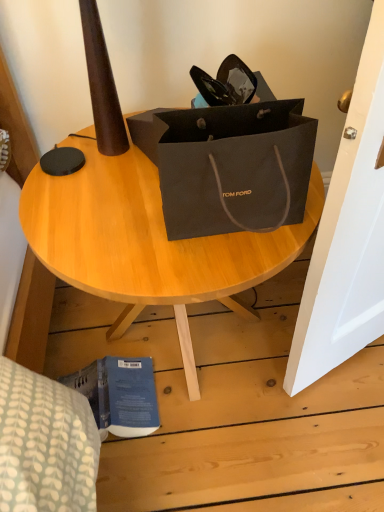
Question: From a real-world perspective, is blue matte book at lower left positioned above or below matte black bag at upper center?

Choices:
 (A) above
 (B) below

Answer: (B)

Question: Is blue matte book at lower left to the left or to the right of matte black bag at upper center in the image?

Choices:
 (A) left
 (B) right

Answer: (A)

Question: In terms of height, does blue matte book at lower left look taller or shorter compared to matte black bag at upper center?

Choices:
 (A) tall
 (B) short

Answer: (B)

Question: Visually, is matte black bag at upper center positioned to the left or to the right of blue matte book at lower left?

Choices:
 (A) left
 (B) right

Answer: (B)

Question: Which is correct: matte black bag at upper center is inside blue matte book at lower left, or outside of it?

Choices:
 (A) outside
 (B) inside

Answer: (A)

Question: Is point (187, 261) positioned closer to the camera than point (134, 412)?

Choices:
 (A) farther
 (B) closer

Answer: (B)

Question: From a real-world perspective, relative to blue matte book at lower left, is matte black bag at upper center vertically above or below?

Choices:
 (A) below
 (B) above

Answer: (B)